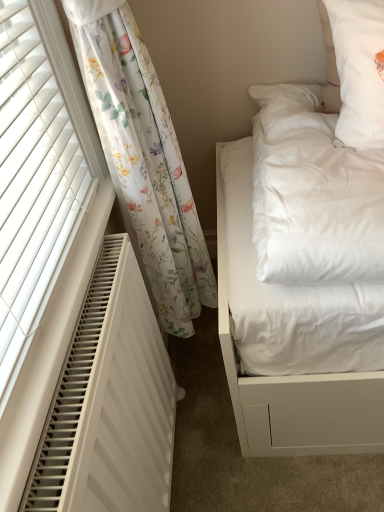
Identify the location of free point below floral sheer curtain at left (from a real-world perspective). This screenshot has height=512, width=384. (204, 361).